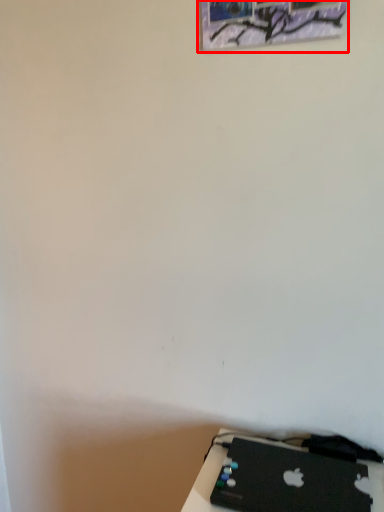
Question: From the image's perspective, what is the correct spatial positioning of picture frame (annotated by the red box) in reference to laptop?

Choices:
 (A) above
 (B) below

Answer: (A)